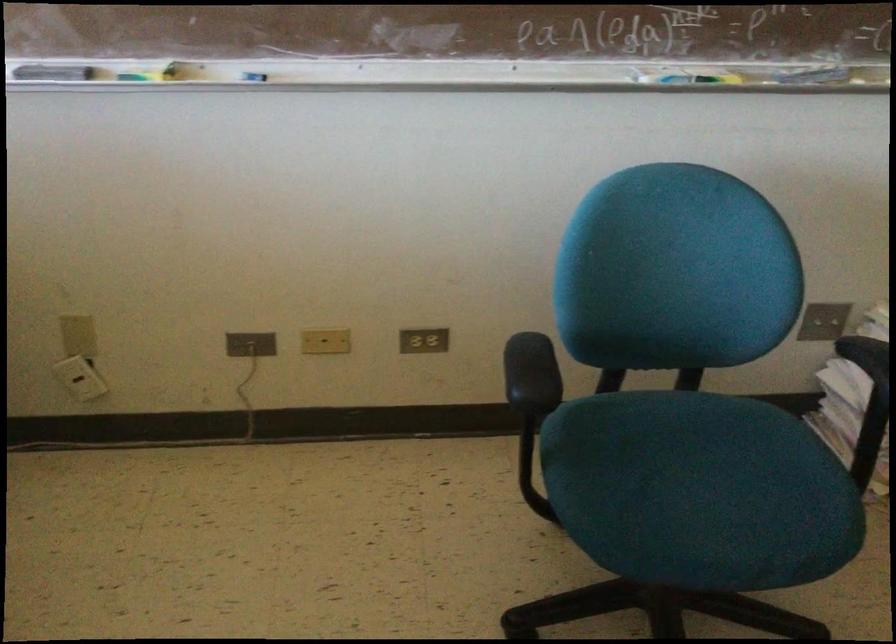
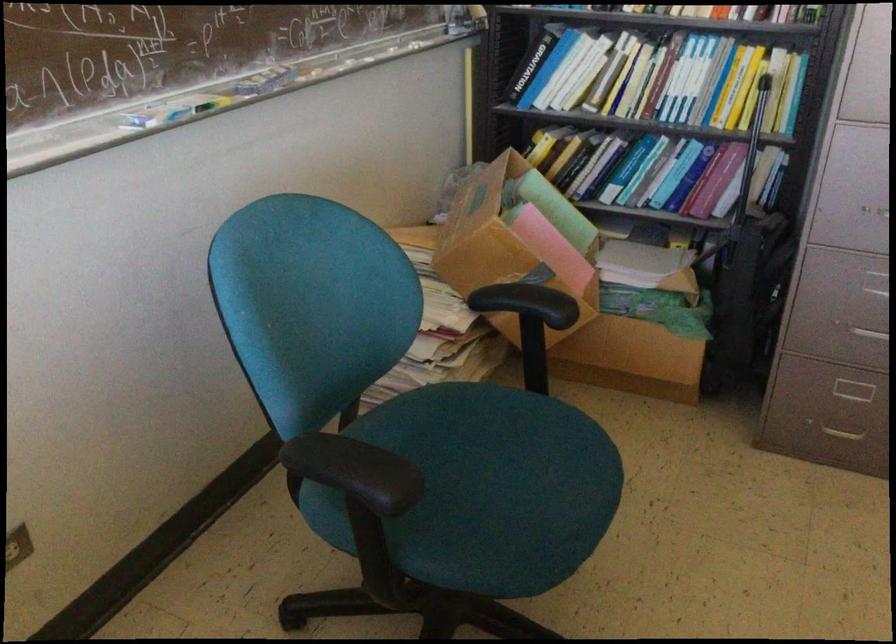
Where in the second image is the point corresponding to [524,360] from the first image?

(356, 471)